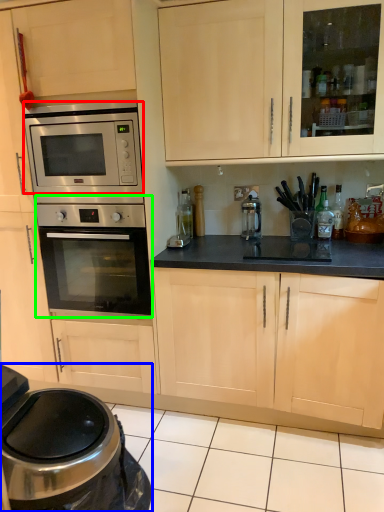
Question: Based on their relative distances, which object is nearer to microwave oven (highlighted by a red box)? Choose from home appliance (highlighted by a blue box) and oven (highlighted by a green box).

Choices:
 (A) home appliance
 (B) oven

Answer: (B)